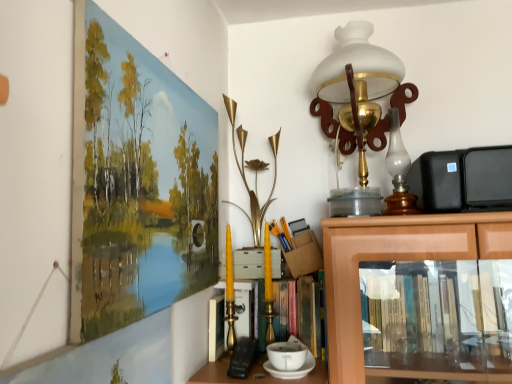
Question: Would you say white frosted glass table lamp at upper right is to the left or to the right of wooden picture frame at upper left in the picture?

Choices:
 (A) left
 (B) right

Answer: (B)

Question: From a real-world perspective, relative to wooden picture frame at upper left, is white frosted glass table lamp at upper right vertically above or below?

Choices:
 (A) below
 (B) above

Answer: (B)

Question: Is white frosted glass table lamp at upper right taller or shorter than wooden picture frame at upper left?

Choices:
 (A) short
 (B) tall

Answer: (B)

Question: Is wooden picture frame at upper left in front of or behind white frosted glass table lamp at upper right in the image?

Choices:
 (A) behind
 (B) front

Answer: (B)

Question: Does point (151, 193) appear closer or farther from the camera than point (366, 137)?

Choices:
 (A) farther
 (B) closer

Answer: (B)

Question: Considering the positions of wooden picture frame at upper left and white frosted glass table lamp at upper right in the image, is wooden picture frame at upper left wider or thinner than white frosted glass table lamp at upper right?

Choices:
 (A) thin
 (B) wide

Answer: (A)

Question: From a real-world perspective, relative to white frosted glass table lamp at upper right, is wooden picture frame at upper left vertically above or below?

Choices:
 (A) above
 (B) below

Answer: (B)